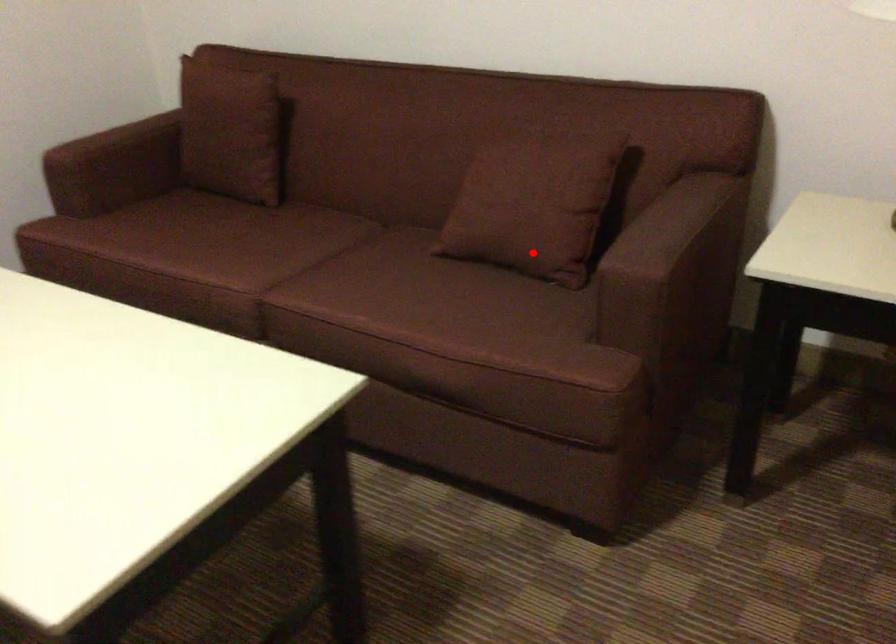
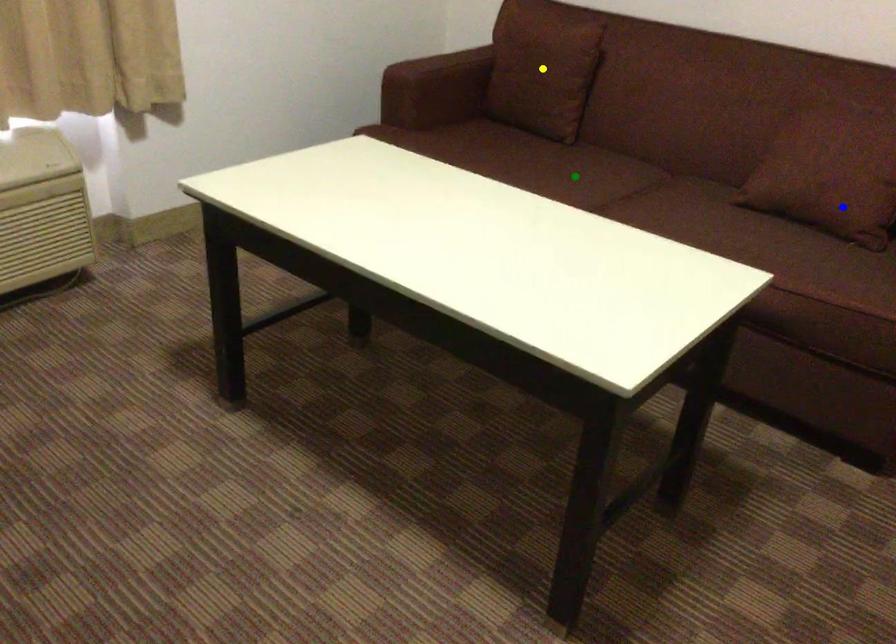
Question: I am providing you with two images of the same scene from different viewpoints. A red point is marked on the first image. You are given multiple points on the second image. Which point in image 2 is actually the same real-world point as the red point in image 1?

Choices:
 (A) yellow point
 (B) blue point
 (C) green point

Answer: (B)